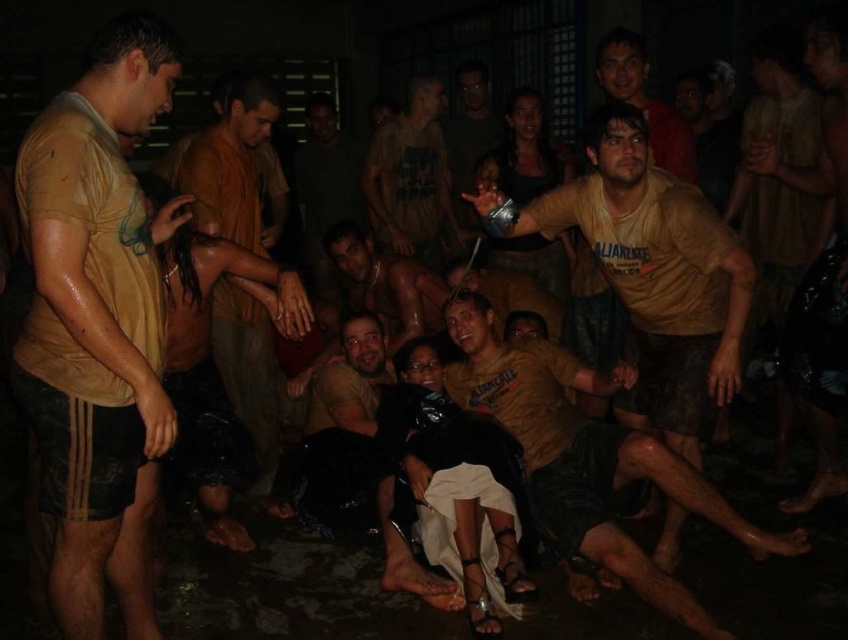
You are a photographer trying to capture a candid shot of the dark brown leather jacket at center. You notice a point at coordinates (360,460) in the image. Based on the scene description, where is this point located relative to the dark brown leather jacket at center?

The point at coordinates (360,460) is located on the dark brown leather jacket at center.

You are a photographer trying to capture a candid shot of the dark brown leather jacket at center and the matte yellow shirt at center. Since you want to focus on the jacket first, which one should you adjust your camera focus to first based on their positions?

The dark brown leather jacket at center is closer to the viewer than the matte yellow shirt at center, so you should adjust your camera focus to the dark brown leather jacket at center first.

You are at a party and see two people wearing a dark brown leather jacket at center and a matte yellow shirt at center. Which one is lower in position?

The dark brown leather jacket at center is below the matte yellow shirt at center, so the person wearing the dark brown leather jacket at center is lower in position.